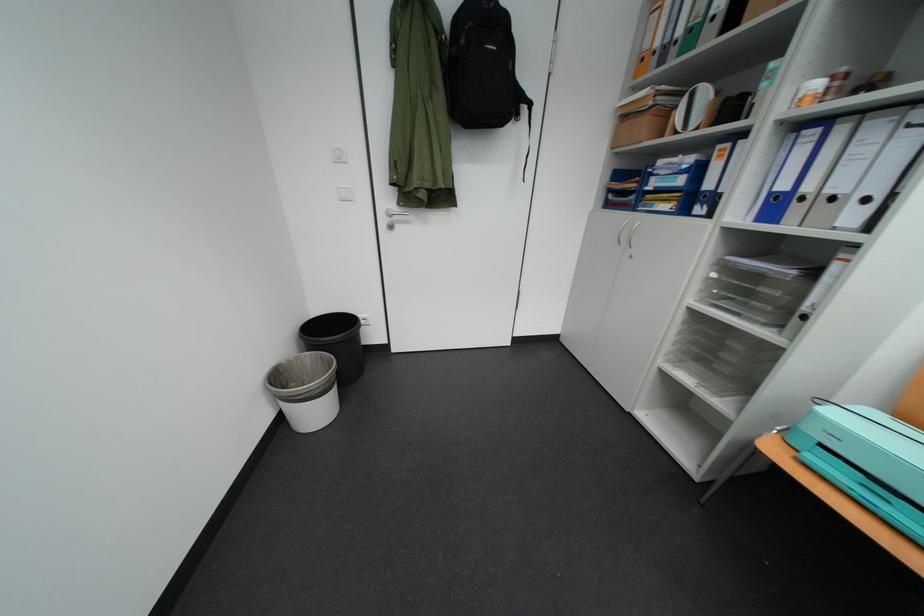
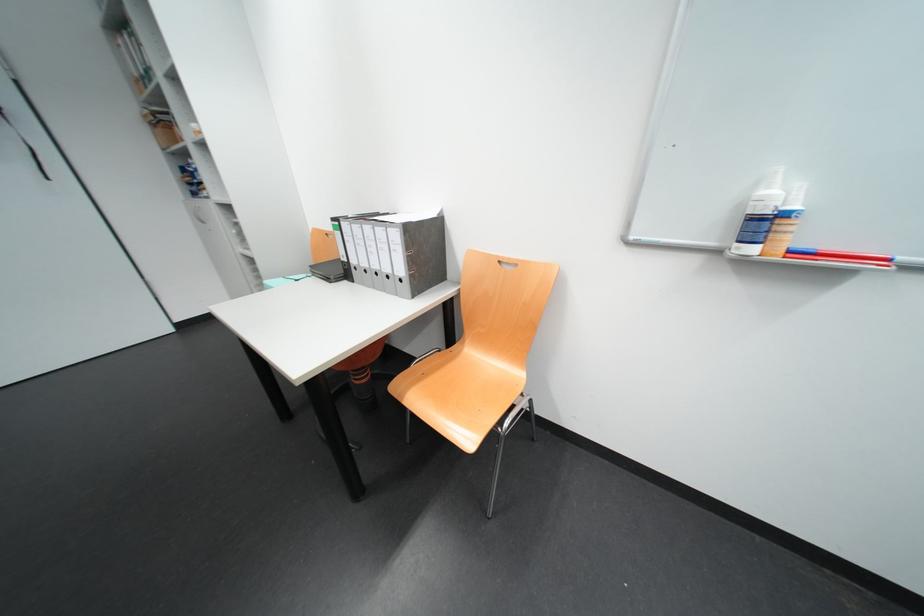
Question: I am providing you with two images of the same scene from different viewpoints. Please identify which objects are invisible in image2.

Choices:
 (A) turquoise binding machine
 (B) blue whiteboard marker
 (C) white spray bottle
 (D) small stone statue

Answer: (A)